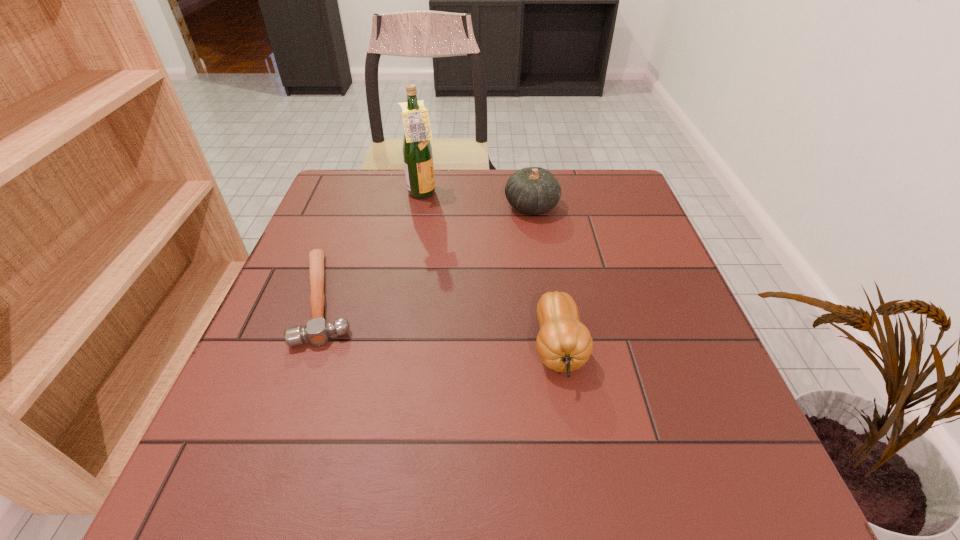
Find the location of `vacant space located on the back of the leftmost object`. vacant space located on the back of the leftmost object is located at coordinates (352, 227).

Where is `liquor that is at the far edge`? Image resolution: width=960 pixels, height=540 pixels. liquor that is at the far edge is located at coordinates (417, 151).

Find the location of a particular element. The width and height of the screenshot is (960, 540). gourd at the far edge is located at coordinates (532, 190).

The width and height of the screenshot is (960, 540). I want to click on object present at the left edge, so click(x=317, y=331).

Where is `blank space at the far edge of the desktop`? This screenshot has height=540, width=960. blank space at the far edge of the desktop is located at coordinates (451, 207).

In the image, there is a desktop. Where is `vacant space at the near edge`? The width and height of the screenshot is (960, 540). vacant space at the near edge is located at coordinates (327, 490).

Find the location of `vacant space at the left edge`. vacant space at the left edge is located at coordinates (339, 347).

Identify the location of vacant space at the right edge of the desktop. (673, 434).

The height and width of the screenshot is (540, 960). Identify the location of vacant space at the far left corner. (364, 186).

Locate an element on the screen. This screenshot has height=540, width=960. free space between the shorter gourd and the farther gourd is located at coordinates (545, 277).